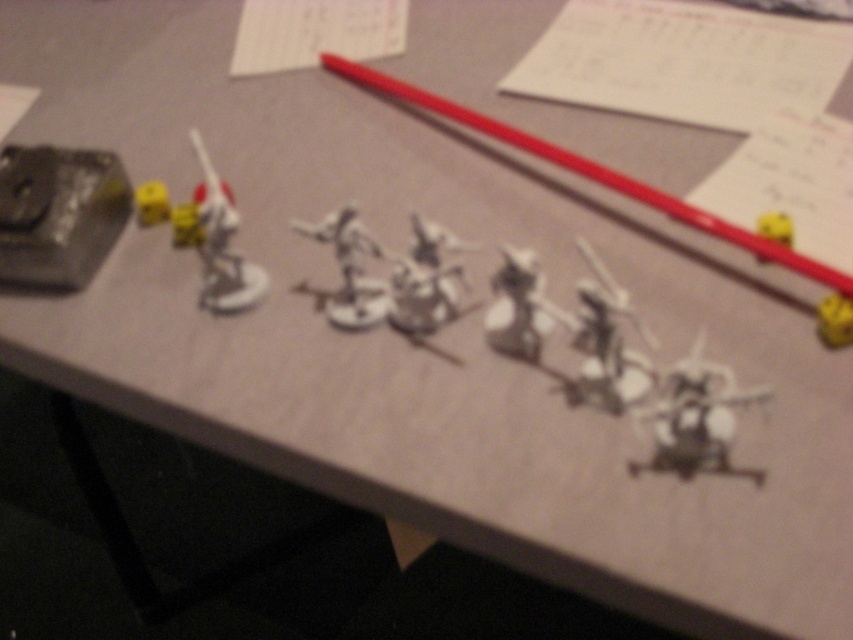
Question: Estimate the real-world distances between objects in this image. Which object is closer to the white plastic toy at center?

Choices:
 (A) yellow matte dice at center
 (B) matte plastic pencil at upper center

Answer: (B)

Question: Which point appears closest to the camera in this image?

Choices:
 (A) (820, 337)
 (B) (434, 227)
 (C) (766, 232)

Answer: (B)

Question: Which of the following is the farthest from the observer?

Choices:
 (A) (438, 112)
 (B) (532, 292)
 (C) (225, 227)
 (D) (352, 272)

Answer: (A)

Question: From the image, what is the correct spatial relationship of gray plastic miniature at center in relation to yellow matte dice at center?

Choices:
 (A) below
 (B) above

Answer: (B)

Question: Is satin silver figure at upper left to the left of yellow matte dice at center from the viewer's perspective?

Choices:
 (A) no
 (B) yes

Answer: (B)

Question: Is yellow matte dice at center above yellow matte toy at upper right?

Choices:
 (A) yes
 (B) no

Answer: (B)